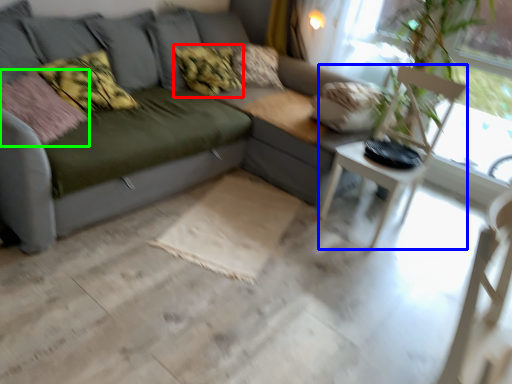
Question: Which is farther away from pillow (highlighted by a red box)? armchair (highlighted by a blue box) or pillow (highlighted by a green box)?

Choices:
 (A) armchair
 (B) pillow

Answer: (A)